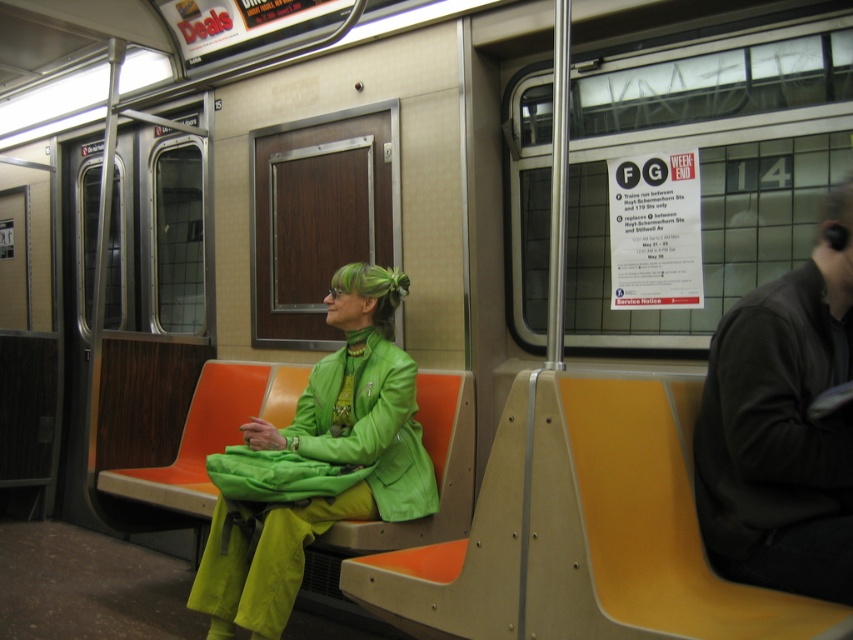
You are standing in the subway car and want to take a photo of both point (811,468) and point (306,440) in the image. Which point should you focus on first to ensure both are in clear view?

You should focus on point (811,468) first because it is closer to the camera than point (306,440), ensuring both points are in clear view.

You are a passenger on the subway and want to see the view outside the window. Which jacket, the dark gray leather jacket at right or the green matte jacket at center, would block your view less if you were sitting behind them?

The dark gray leather jacket at right is in front of the green matte jacket at center, so the green matte jacket at center would block your view less since it is positioned behind the dark gray leather jacket at right.